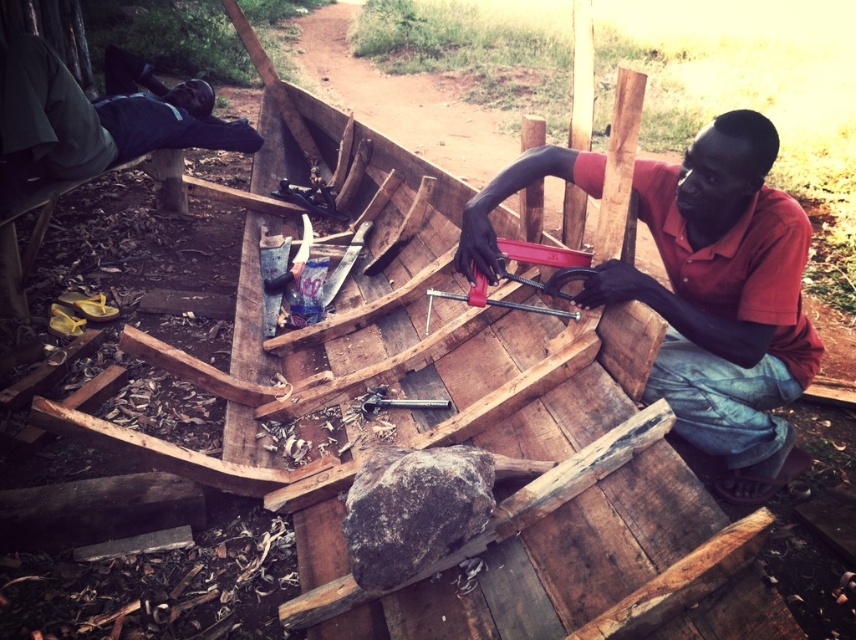
Question: Which point is closer to the camera?

Choices:
 (A) green fabric shirt at upper left
 (B) metallic red clamp at center
 (C) red matte wood at center

Answer: (C)

Question: Is red matte wood at center wider than green fabric shirt at upper left?

Choices:
 (A) no
 (B) yes

Answer: (B)

Question: From the image, what is the correct spatial relationship of red matte wood at center in relation to green fabric shirt at upper left?

Choices:
 (A) below
 (B) above

Answer: (A)

Question: Does red matte wood at center appear over green fabric shirt at upper left?

Choices:
 (A) no
 (B) yes

Answer: (A)

Question: Among these points, which one is farthest from the camera?

Choices:
 (A) (663, 344)
 (B) (471, 282)
 (C) (128, 106)

Answer: (C)

Question: Which object appears farthest from the camera in this image?

Choices:
 (A) metallic red clamp at center
 (B) red matte wood at center

Answer: (A)